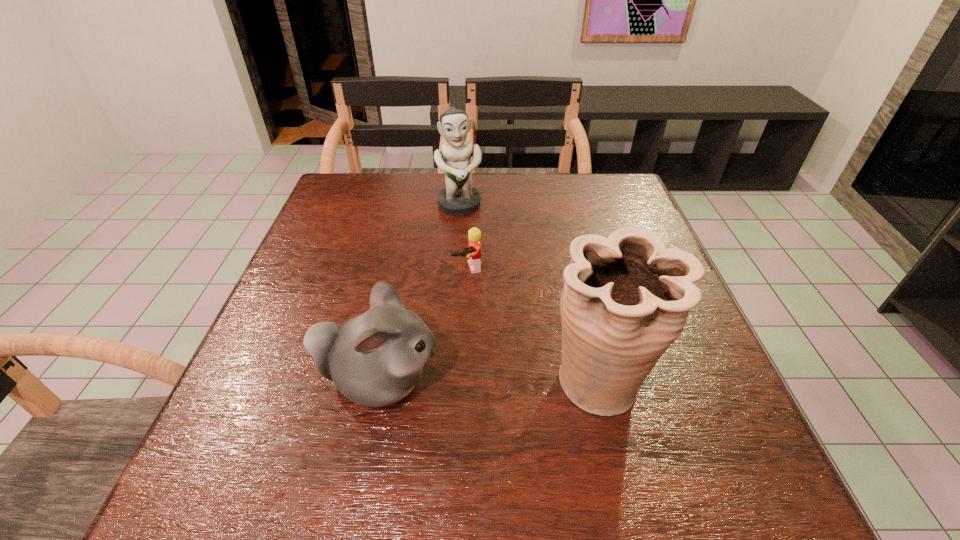
In the image, there is a desktop. In order to click on vacant space at the far edge in this screenshot , I will do `click(431, 195)`.

Locate an element on the screen. This screenshot has width=960, height=540. free space at the near edge is located at coordinates (595, 433).

Locate an element on the screen. The width and height of the screenshot is (960, 540). vacant space at the left edge of the desktop is located at coordinates (280, 343).

Locate an element on the screen. vacant space at the right edge of the desktop is located at coordinates (609, 219).

Image resolution: width=960 pixels, height=540 pixels. I want to click on vacant space at the far left corner of the desktop, so click(345, 178).

Where is `vacant space at the near left corner of the desktop`? This screenshot has width=960, height=540. vacant space at the near left corner of the desktop is located at coordinates (233, 396).

This screenshot has width=960, height=540. In the image, there is a desktop. What are the coordinates of `vacant space at the far right corner` in the screenshot? It's located at (577, 175).

Where is `free spot between the farthest object and the urn`? This screenshot has height=540, width=960. free spot between the farthest object and the urn is located at coordinates (530, 293).

Locate an element on the screen. The width and height of the screenshot is (960, 540). vacant space that's between the rightmost object and the Lego is located at coordinates (534, 325).

Identify the location of free space between the figurine and the hamster. (420, 294).